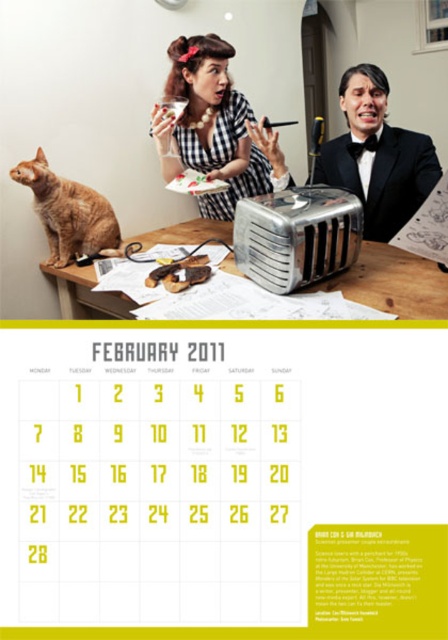
In the scene shown: Is shiny black suit at center positioned at the back of brown crispy bread at center?

That is True.

Which is more to the right, shiny black suit at center or brown crispy bread at center?

Positioned to the right is shiny black suit at center.

Locate an element on the screen. shiny black suit at center is located at coordinates (377, 156).

Where is `shiny black suit at center`? The image size is (448, 640). shiny black suit at center is located at coordinates (377, 156).

Who is more distant from viewer, (214, 228) or (56, 208)?

The point (214, 228) is more distant.

Can you confirm if brown wooden table at center is smaller than orange fur cat at left?

Actually, brown wooden table at center might be larger than orange fur cat at left.

Which is in front, point (413, 280) or point (20, 170)?

Point (413, 280)

Identify the location of brown wooden table at center. (393, 284).

From the picture: Is shiny black suit at center to the left of silver metallic toaster at center from the viewer's perspective?

Incorrect, shiny black suit at center is not on the left side of silver metallic toaster at center.

Which of these two, shiny black suit at center or silver metallic toaster at center, stands taller?

With more height is shiny black suit at center.

What do you see at coordinates (377, 156) in the screenshot? This screenshot has height=640, width=448. I see `shiny black suit at center` at bounding box center [377, 156].

At what (x,y) coordinates should I click in order to perform the action: click on shiny black suit at center. Please return your answer as a coordinate pair (x, y). Looking at the image, I should click on (377, 156).